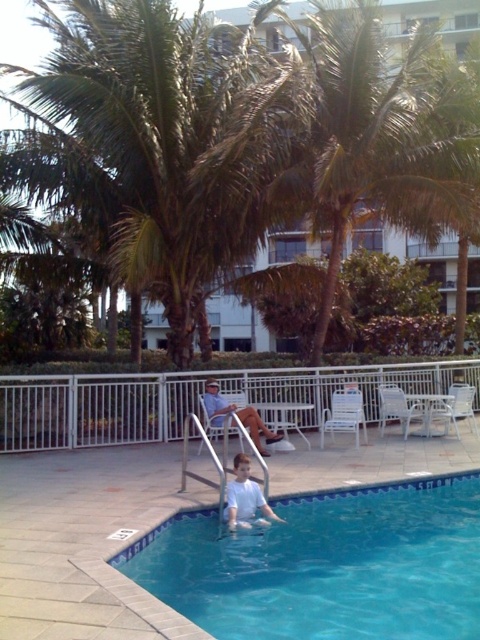
Question: Can you confirm if green leafy palm tree at center is smaller than white matte shirt at lower center?

Choices:
 (A) no
 (B) yes

Answer: (B)

Question: In this image, where is green leafy palm tree at center located relative to white fabric chair at center?

Choices:
 (A) left
 (B) right

Answer: (B)

Question: Which point appears closest to the camera in this image?

Choices:
 (A) (250, 481)
 (B) (206, 396)
 (C) (331, 24)
 (D) (381, 497)

Answer: (A)

Question: Which point is farther from the camera taking this photo?

Choices:
 (A) (456, 499)
 (B) (470, 104)
 (C) (230, 506)
 (D) (215, 424)

Answer: (B)

Question: Which point is closer to the camera?

Choices:
 (A) green leafy palm tree at center
 (B) white matte shirt at lower center

Answer: (B)

Question: Is green leafy palm tree at center bigger than white matte shirt at lower center?

Choices:
 (A) yes
 (B) no

Answer: (B)